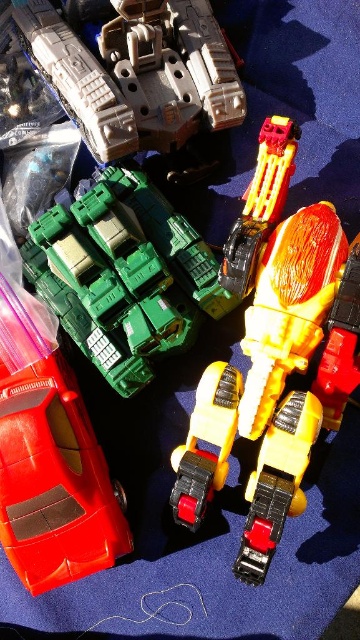
Question: Observing the image, what is the correct spatial positioning of yellow matte truck at center in reference to shiny plastic robot at center?

Choices:
 (A) left
 (B) right

Answer: (A)

Question: Is yellow matte truck at center positioned in front of shiny plastic robot at center?

Choices:
 (A) yes
 (B) no

Answer: (B)

Question: Which point is closer to the camera taking this photo?

Choices:
 (A) (155, 35)
 (B) (61, 484)
 (C) (204, 381)

Answer: (B)

Question: Among these points, which one is nearest to the camera?

Choices:
 (A) (204, 387)
 (B) (36, 42)

Answer: (B)

Question: Can you confirm if shiny red car at lower left is positioned to the right of shiny plastic robot at center?

Choices:
 (A) yes
 (B) no

Answer: (B)

Question: Estimate the real-world distances between objects in this image. Which object is farther from the yellow matte truck at center?

Choices:
 (A) shiny plastic robot at center
 (B) shiny plastic car at center

Answer: (A)